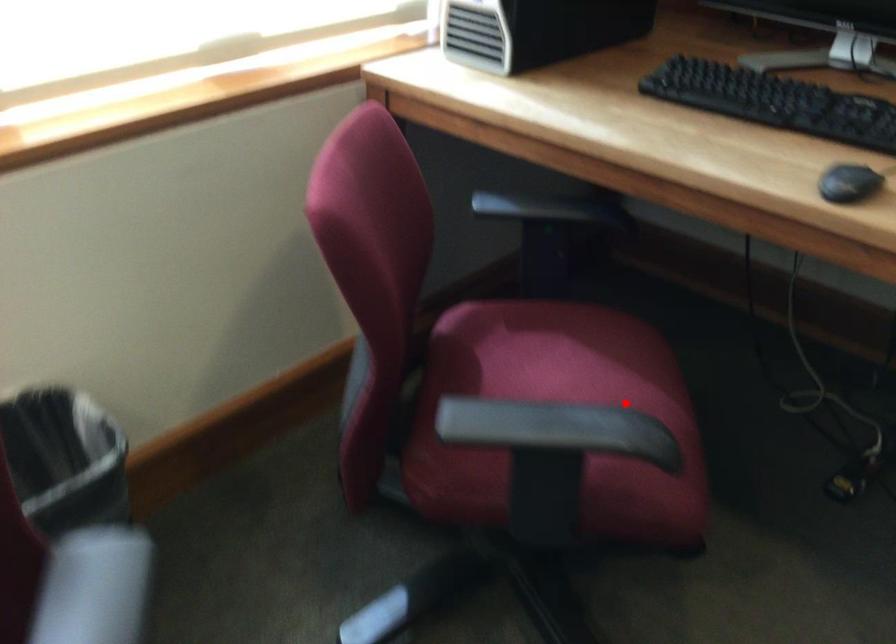
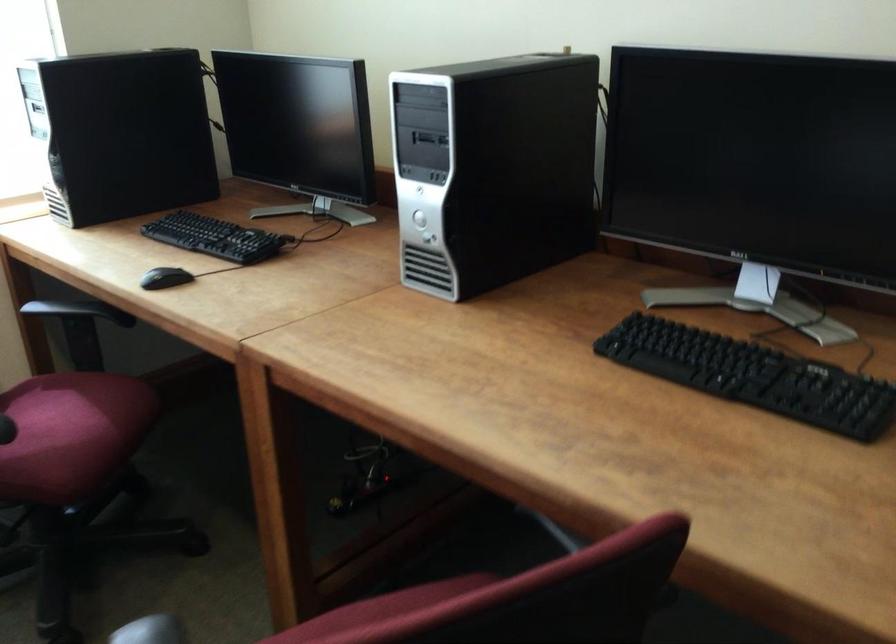
Question: I am providing you with two images of the same scene from different viewpoints. In image1, a red point is highlighted. Considering the same 3D point in image2, which of the following is correct?

Choices:
 (A) It is closer
 (B) It is farther

Answer: (B)